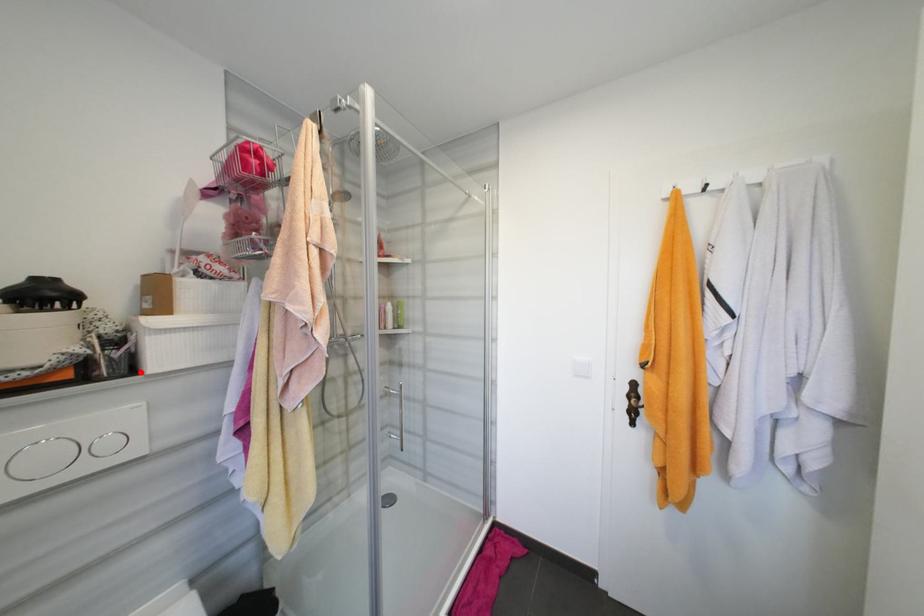
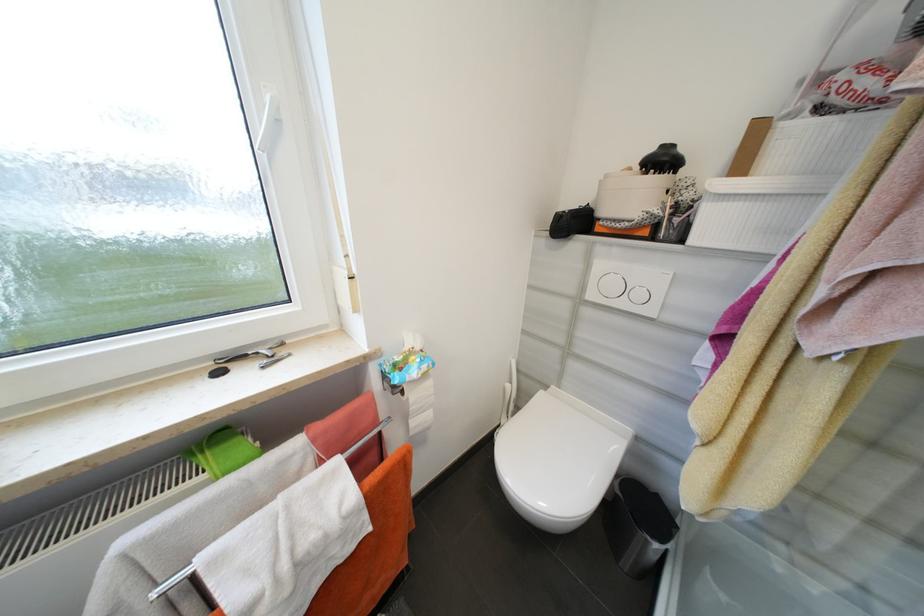
Locate, in the second image, the point that corresponds to the highlighted location in the first image.

(687, 241)